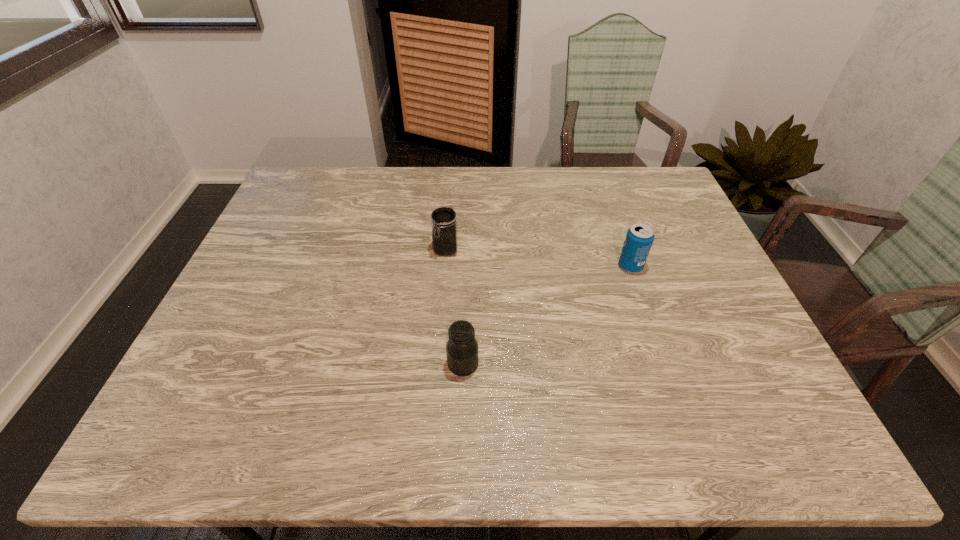
In order to click on unoccupied position between the nearer jar and the farther jar in this screenshot , I will do `click(454, 307)`.

Where is `free space between the soda can and the nearest object`? free space between the soda can and the nearest object is located at coordinates (547, 315).

Find the location of a particular element. The image size is (960, 540). empty space between the nearer jar and the farther jar is located at coordinates (454, 307).

Where is `free space between the soda can and the farther jar`? This screenshot has height=540, width=960. free space between the soda can and the farther jar is located at coordinates (539, 258).

Image resolution: width=960 pixels, height=540 pixels. I want to click on free space between the nearer jar and the rightmost object, so click(x=547, y=315).

Identify the location of free space that is in between the soda can and the nearest object. The width and height of the screenshot is (960, 540). (547, 315).

The width and height of the screenshot is (960, 540). Identify the location of free space that is in between the farther jar and the nearer jar. (454, 307).

You are a GUI agent. You are given a task and a screenshot of the screen. Output one action in this format:
    pyautogui.click(x=<x>, y=<y>)
    Task: Click on the empty location between the farther jar and the rightmost object
    The width and height of the screenshot is (960, 540).
    Given the screenshot: What is the action you would take?
    pyautogui.click(x=539, y=258)

You are a GUI agent. You are given a task and a screenshot of the screen. Output one action in this format:
    pyautogui.click(x=<x>, y=<y>)
    Task: Click on the free spot between the soda can and the farther jar
    The width and height of the screenshot is (960, 540).
    Given the screenshot: What is the action you would take?
    pyautogui.click(x=539, y=258)

Image resolution: width=960 pixels, height=540 pixels. I want to click on empty location between the rightmost object and the nearer jar, so click(x=547, y=315).